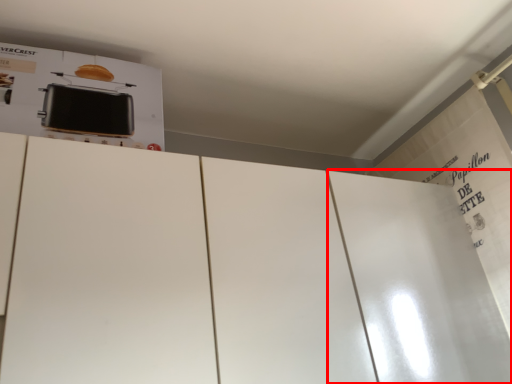
Question: From the image's perspective, where is door (annotated by the red box) located in relation to appliance in the image?

Choices:
 (A) above
 (B) below

Answer: (B)